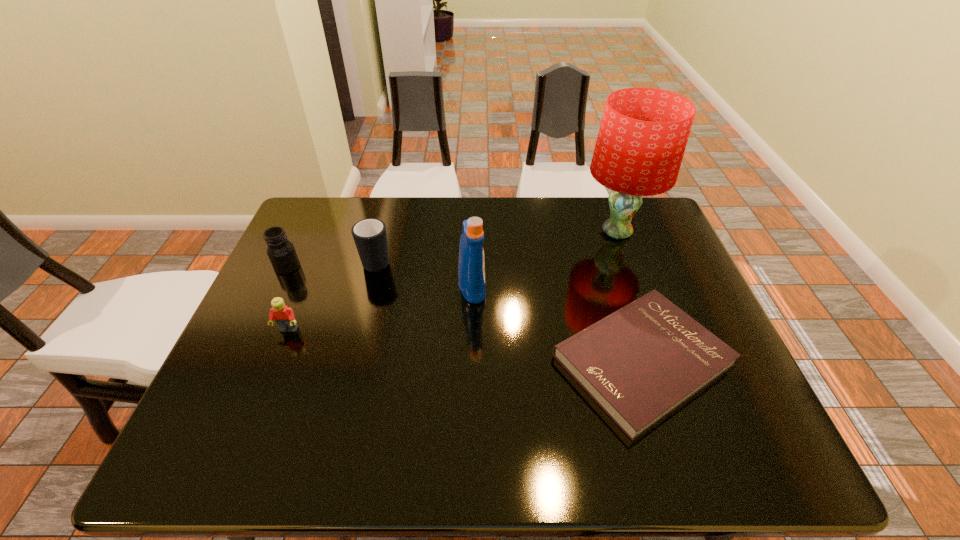
At what (x,y) coordinates should I click in order to perform the action: click on vacant space situated on the front-facing side of the lampshade. Please return your answer as a coordinate pair (x, y). This screenshot has height=540, width=960. Looking at the image, I should click on (546, 232).

Identify the location of blank space located 0.100m on the label of the detergent. (523, 287).

Identify the location of vacant point located 0.140m on the side of the third object from left to right with the handle. The width and height of the screenshot is (960, 540). (388, 217).

Image resolution: width=960 pixels, height=540 pixels. Identify the location of blank space located on the side of the third object from left to right with the handle. (387, 222).

Where is `free point located on the side of the third object from left to right with the handle`? free point located on the side of the third object from left to right with the handle is located at coordinates (387, 222).

Find the location of a particular element. This screenshot has width=960, height=540. blank space located 0.280m on the right of the jar is located at coordinates (399, 267).

The height and width of the screenshot is (540, 960). What are the coordinates of `free space located 0.120m on the face of the second shortest object` in the screenshot? It's located at (269, 379).

Where is `blank area located on the left of the hardback book`? This screenshot has width=960, height=540. blank area located on the left of the hardback book is located at coordinates (469, 360).

At what (x,y) coordinates should I click in order to perform the action: click on object situated at the far edge. Please return your answer as a coordinate pair (x, y). The height and width of the screenshot is (540, 960). Looking at the image, I should click on (643, 134).

Find the location of `object situated at the near edge`. object situated at the near edge is located at coordinates (640, 363).